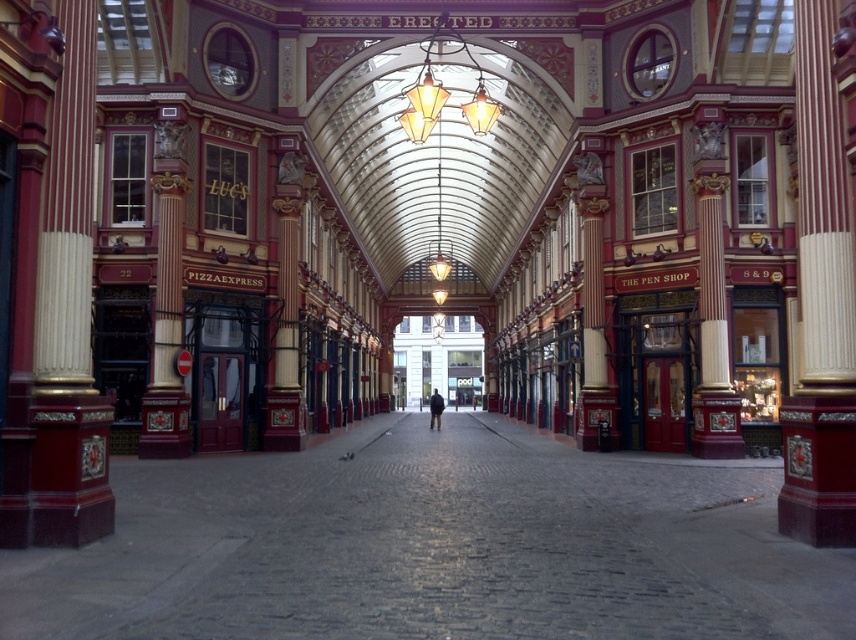
Question: Considering the real-world distances, which object is farthest from the polished red pillar at right?

Choices:
 (A) matte gold column at left
 (B) dark blue jacket at center

Answer: (B)

Question: Which of the following is the closest to the observer?

Choices:
 (A) dark blue jacket at center
 (B) polished red pillar at right
 (C) matte gold column at left

Answer: (C)

Question: Can you confirm if matte gold column at left is thinner than dark blue jacket at center?

Choices:
 (A) yes
 (B) no

Answer: (A)

Question: Estimate the real-world distances between objects in this image. Which object is closer to the matte gold column at left?

Choices:
 (A) polished red pillar at right
 (B) dark blue jacket at center

Answer: (A)

Question: Does polished red pillar at right appear over dark blue jacket at center?

Choices:
 (A) no
 (B) yes

Answer: (B)

Question: Does matte gold column at left appear on the left side of dark blue jacket at center?

Choices:
 (A) no
 (B) yes

Answer: (B)